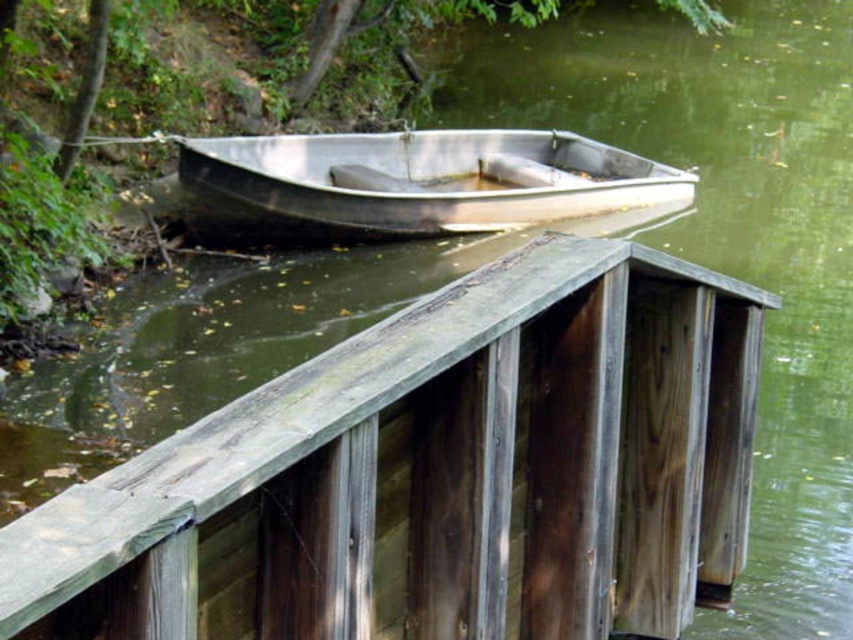
Question: Considering the relative positions of weathered wood rail at center and metallic silver boat at center in the image provided, where is weathered wood rail at center located with respect to metallic silver boat at center?

Choices:
 (A) left
 (B) right

Answer: (B)

Question: Is the position of weathered wood rail at center less distant than that of metallic silver boat at center?

Choices:
 (A) no
 (B) yes

Answer: (B)

Question: Observing the image, what is the correct spatial positioning of weathered wood rail at center in reference to metallic silver boat at center?

Choices:
 (A) above
 (B) below

Answer: (B)